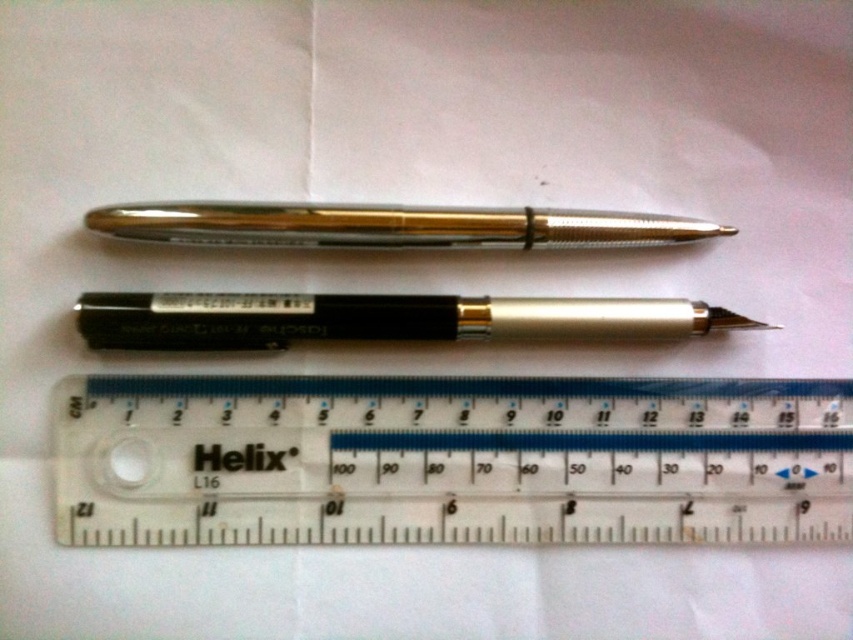
Question: Which of these objects is positioned closest to the gold metallic pen at center?

Choices:
 (A) transparent plastic ruler at center
 (B) black metallic pen at center

Answer: (B)

Question: Where is transparent plastic ruler at center located in relation to gold metallic pen at center in the image?

Choices:
 (A) below
 (B) above

Answer: (A)

Question: Estimate the real-world distances between objects in this image. Which object is farther from the gold metallic pen at center?

Choices:
 (A) black metallic pen at center
 (B) transparent plastic ruler at center

Answer: (B)

Question: Is transparent plastic ruler at center to the left of gold metallic pen at center from the viewer's perspective?

Choices:
 (A) no
 (B) yes

Answer: (A)

Question: Which object is the farthest from the gold metallic pen at center?

Choices:
 (A) transparent plastic ruler at center
 (B) black metallic pen at center

Answer: (A)

Question: Is transparent plastic ruler at center bigger than gold metallic pen at center?

Choices:
 (A) no
 (B) yes

Answer: (B)